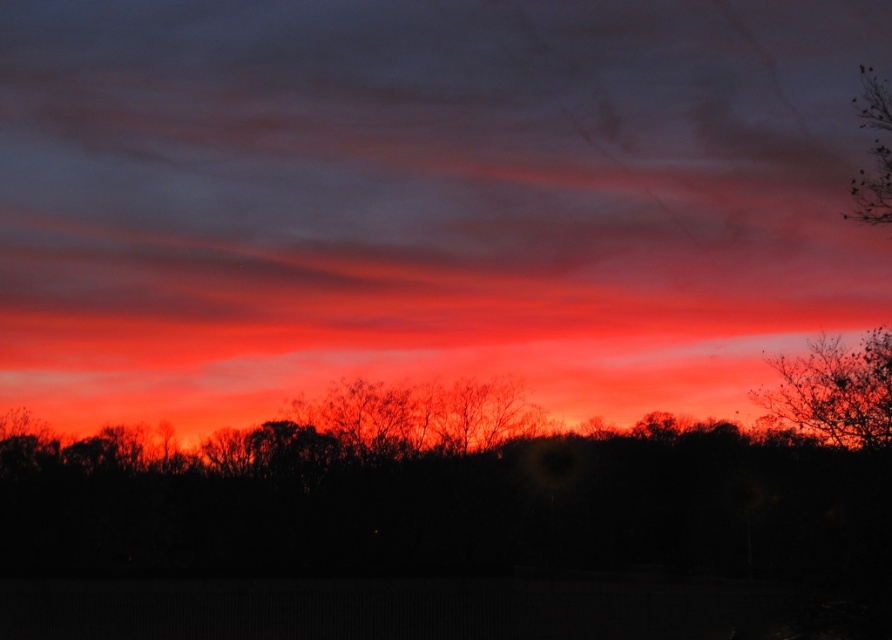
Question: Where is silhouetted bare branches at upper right located in relation to silhouette bare tree at upper right in the image?

Choices:
 (A) left
 (B) right

Answer: (A)

Question: Based on their relative distances, which object is nearer to the silhouetted bare branches at upper right?

Choices:
 (A) matte orange cloud at center
 (B) silhouette bare tree at upper right

Answer: (B)

Question: Which object appears farthest from the camera in this image?

Choices:
 (A) silhouette bare tree at upper right
 (B) silhouetted bare branches at upper right

Answer: (B)

Question: Does matte orange cloud at center have a greater width compared to silhouette bare tree at upper right?

Choices:
 (A) no
 (B) yes

Answer: (B)

Question: Which of the following is the farthest from the observer?

Choices:
 (A) silhouetted bare branches at upper right
 (B) matte orange cloud at center

Answer: (B)

Question: Is matte orange cloud at center above silhouetted bare branches at upper right?

Choices:
 (A) no
 (B) yes

Answer: (B)